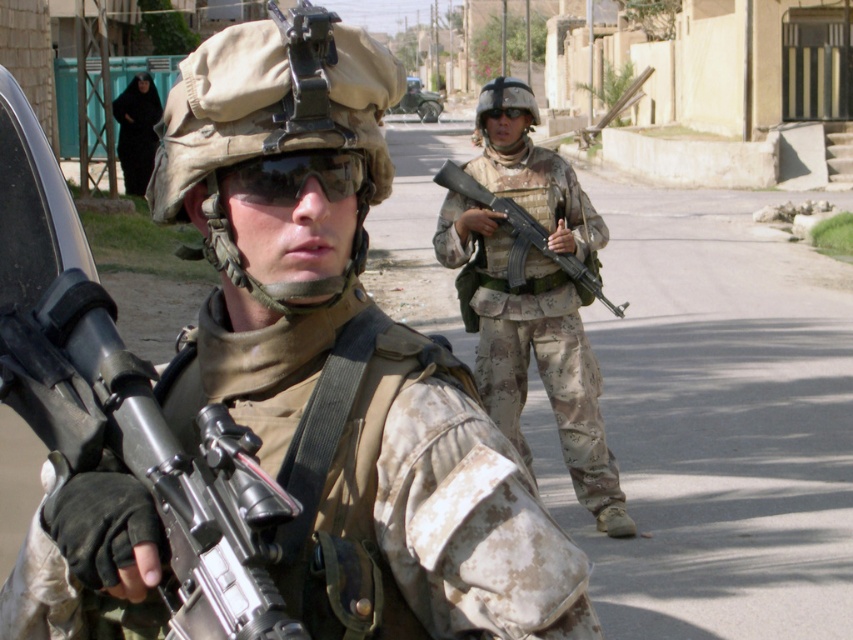
What is the location of the point with coordinates (293, 177) in the image?

The point with coordinates (293, 177) is located on the sunglassesmatte at center.